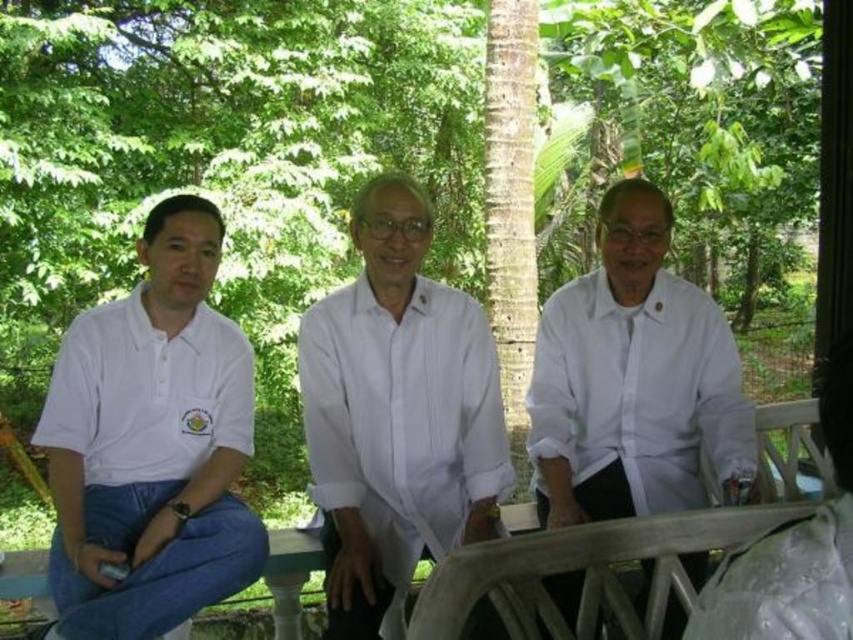
Does point (260, 259) come in front of point (772, 529)?

That is False.

Is green leafy tree at center thinner than white fabric bag at center?

In fact, green leafy tree at center might be wider than white fabric bag at center.

You are a GUI agent. You are given a task and a screenshot of the screen. Output one action in this format:
    pyautogui.click(x=<x>, y=<y>)
    Task: Click on the green leafy tree at center
    The height and width of the screenshot is (640, 853).
    Given the screenshot: What is the action you would take?
    pyautogui.click(x=224, y=150)

What do you see at coordinates (148, 394) in the screenshot? The height and width of the screenshot is (640, 853). I see `white matte polo shirt at left` at bounding box center [148, 394].

Based on the photo, does white matte polo shirt at left have a lesser width compared to white fabric bag at center?

Incorrect, white matte polo shirt at left's width is not less than white fabric bag at center's.

Who is more distant from viewer, (148, 362) or (689, 616)?

The point (148, 362) is behind.

This screenshot has height=640, width=853. I want to click on white matte polo shirt at left, so click(148, 394).

This screenshot has height=640, width=853. What do you see at coordinates (151, 444) in the screenshot?
I see `white cotton polo shirt at left` at bounding box center [151, 444].

Which of these two, white cotton polo shirt at left or white fabric bag at center, stands shorter?

Standing shorter between the two is white fabric bag at center.

Locate an element on the screen. white cotton polo shirt at left is located at coordinates (151, 444).